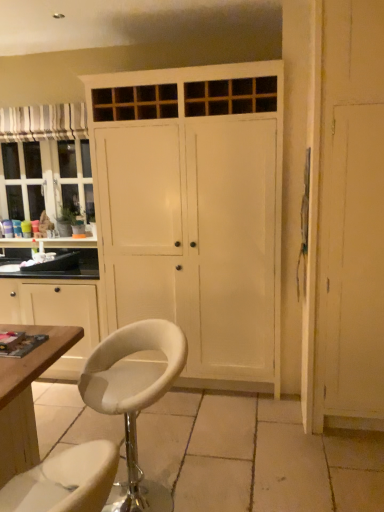
Locate an element on the screen. The height and width of the screenshot is (512, 384). vacant space in front of white painted wood cupboard at center is located at coordinates (245, 442).